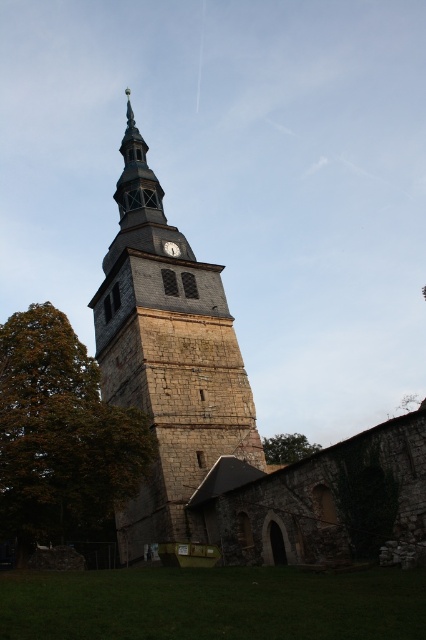
Question: Considering the relative positions of stone clock tower at center and metallic gray clock at center in the image provided, where is stone clock tower at center located with respect to metallic gray clock at center?

Choices:
 (A) right
 (B) left

Answer: (B)

Question: Which of these objects is positioned farthest from the green leafy tree at left?

Choices:
 (A) green leafy tree at center
 (B) stone clock tower at center
 (C) metallic gray clock at center

Answer: (C)

Question: Is stone clock tower at center below green leafy tree at center?

Choices:
 (A) no
 (B) yes

Answer: (A)

Question: Where is stone clock tower at center located in relation to metallic gray clock at center in the image?

Choices:
 (A) left
 (B) right

Answer: (A)

Question: Based on their relative distances, which object is nearer to the stone clock tower at center?

Choices:
 (A) green leafy tree at center
 (B) green leafy tree at left

Answer: (B)

Question: Which object is closer to the camera taking this photo?

Choices:
 (A) green leafy tree at center
 (B) metallic gray clock at center
 (C) stone clock tower at center
 (D) green leafy tree at left

Answer: (D)